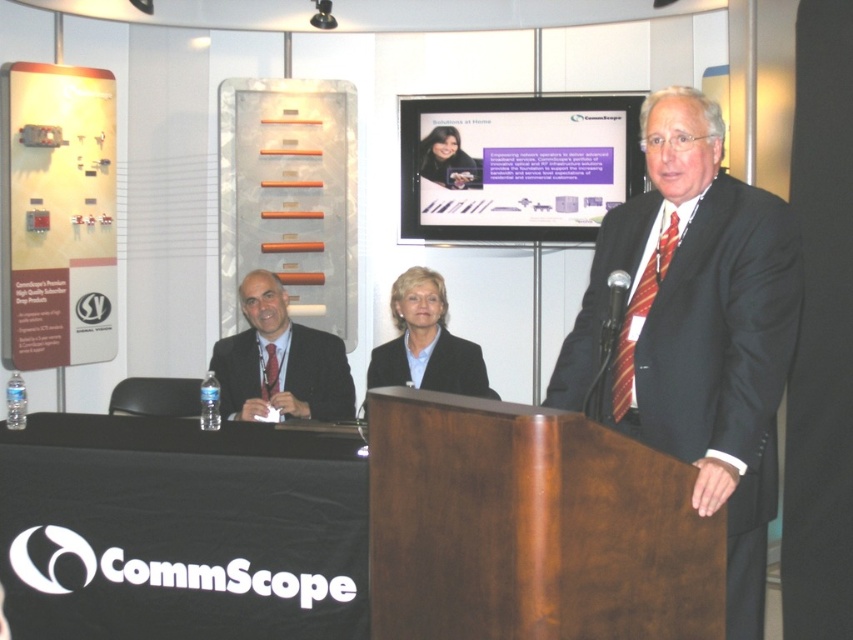
Does dark suit at left have a lesser width compared to black fabric business suit at center?

No, dark suit at left is not thinner than black fabric business suit at center.

Is point (229, 413) positioned after point (370, 387)?

No, (229, 413) is closer to viewer.

The image size is (853, 640). Identify the location of dark suit at left. (280, 362).

Who is shorter, dark suit at center or smooth black jacket at upper center?

smooth black jacket at upper center is shorter.

Describe the element at coordinates (698, 330) in the screenshot. I see `dark suit at center` at that location.

At what (x,y) coordinates should I click in order to perform the action: click on dark suit at center. Please return your answer as a coordinate pair (x, y). This screenshot has width=853, height=640. Looking at the image, I should click on (698, 330).

Is black fabric business suit at center smaller than smooth black jacket at upper center?

Actually, black fabric business suit at center might be larger than smooth black jacket at upper center.

Between black fabric business suit at center and smooth black jacket at upper center, which one has more height?

smooth black jacket at upper center

Locate an element on the screen. black fabric business suit at center is located at coordinates (456, 368).